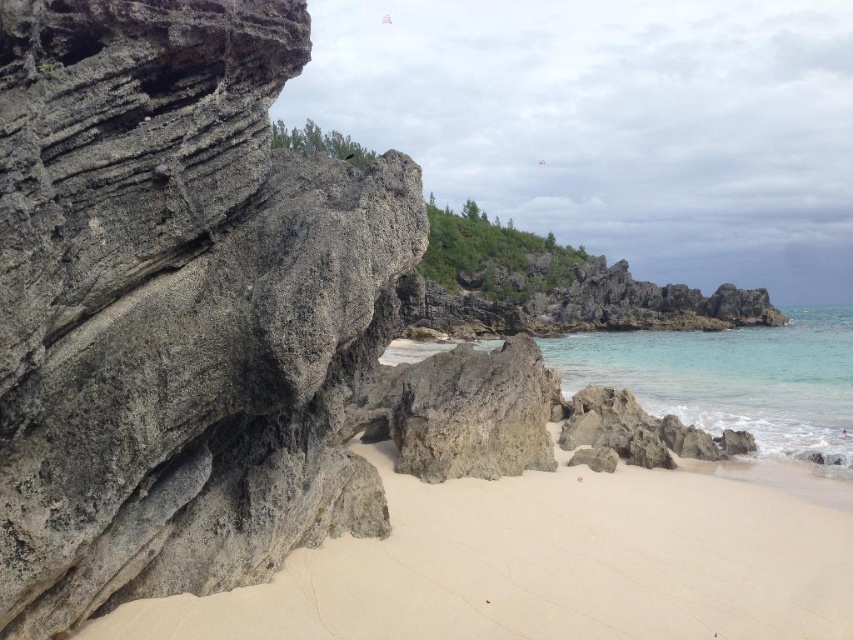
You are standing on the sandy beach at lower left and want to reach the gray rough rock at left. Which direction should you move to get there?

The gray rough rock at left is positioned over the sandy beach at lower left, so you should move upward from the sandy beach at lower left to reach the gray rough rock at left.

You are standing at the origin point of the coordinate system in the beach scene. The gray rough rock at left is located at point (177, 305). If you want to reach the gray rough rock at left, which direction should you move in?

The gray rough rock at left is located at point (177, 305), so you should move towards the left side of the scene to reach it.

You are standing on the beach and want to walk from the gray rough rock at left to the clear water at beach center. Which direction should you move to reach the water?

The gray rough rock at left is above the clear water at beach center, so you should move downward from the gray rough rock at left to reach the clear water at beach center.